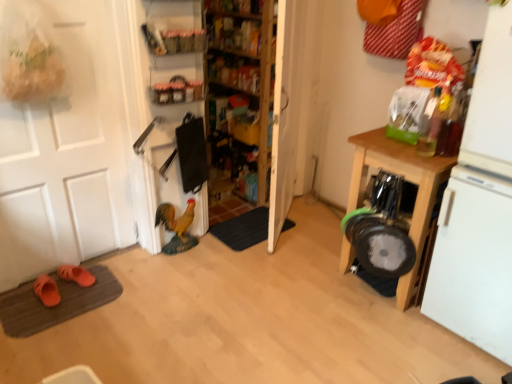
This screenshot has height=384, width=512. I want to click on vacant space that is to the left of white matte refrigerator at right, so click(x=392, y=339).